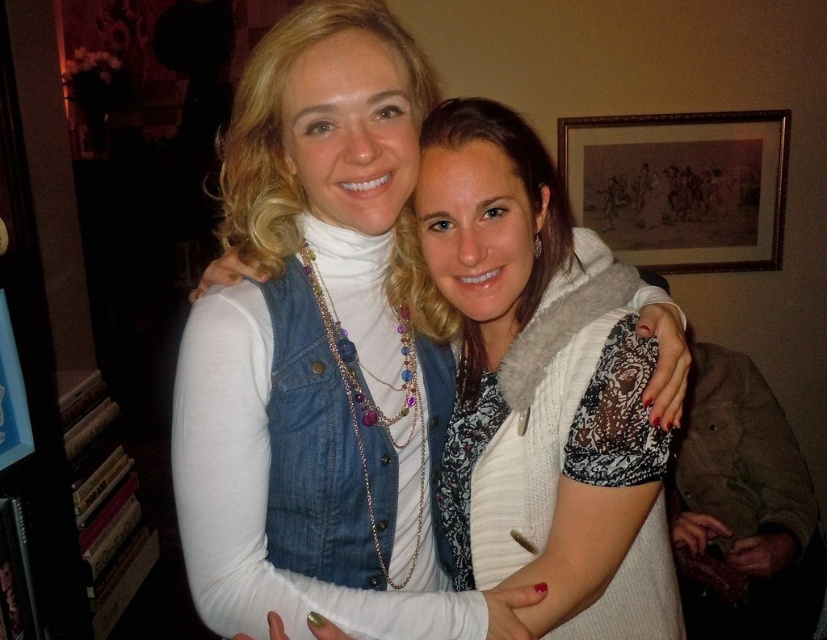
Question: Is denim vest at center above wooden framed artwork at upper right?

Choices:
 (A) yes
 (B) no

Answer: (B)

Question: Is denim vest at center further to camera compared to wooden framed artwork at upper right?

Choices:
 (A) no
 (B) yes

Answer: (A)

Question: Which point is closer to the camera?

Choices:
 (A) wooden framed artwork at upper right
 (B) denim vest at center

Answer: (B)

Question: Does denim vest at center have a lesser width compared to wooden framed artwork at upper right?

Choices:
 (A) no
 (B) yes

Answer: (B)